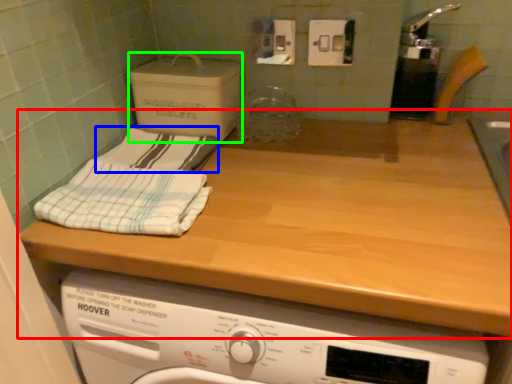
Question: Considering the real-world distances, which object is closest to countertop (highlighted by a red box)? bath towel (highlighted by a blue box) or cardboard box (highlighted by a green box).

Choices:
 (A) bath towel
 (B) cardboard box

Answer: (A)